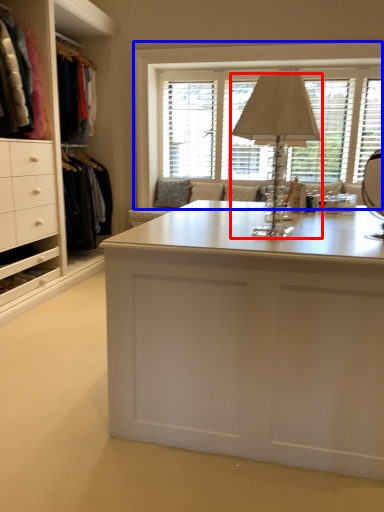
Question: Among these objects, which one is farthest to the camera, table lamp (highlighted by a red box) or window (highlighted by a blue box)?

Choices:
 (A) table lamp
 (B) window

Answer: (B)